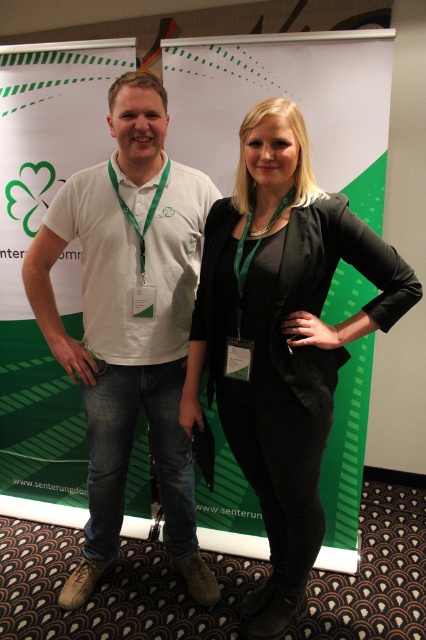
In the scene shown: You are at an event and need to identify the location of the green fabric banner at center relative to the white cotton polo shirt at left. Based on the scene, can you determine its position?

The green fabric banner at center is to the right of the white cotton polo shirt at left.

You are organizing a photo shoot and need to ensure that the green fabric banner at center and the black leather blazer at center are both visible in the frame. Given that the banner is larger, which object should you prioritize positioning closer to the camera to maintain clarity and detail?

The black leather blazer at center should be positioned closer to the camera since it is smaller than the green fabric banner at center. This ensures both objects are visible and detailed in the photo.

Consider the image. What is the coordinate of the green fabric banner at center?

The green fabric banner at center is located at point (x=23, y=253).